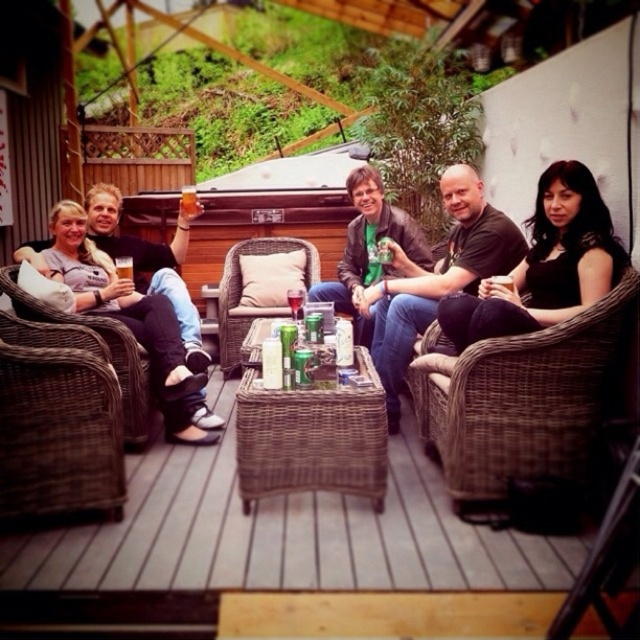
You are a guest at this outdoor gathering and want to sit in a chair that is taller. Which chair should you choose between the brown wicker chair at left and the woven wicker chair at center?

The woven wicker chair at center is taller than the brown wicker chair at left, so you should choose the woven wicker chair at center.

You are a person who is 1.8 meters tall and wants to sit on the brown wicker chair at lower left. However, you notice the matte plastic cup at center is placed on the seat. Can you sit down comfortably without bending over?

The brown wicker chair at lower left is much taller as matte plastic cup at center, so the chair is taller than the cup. Since the chair is taller, you can sit comfortably without bending over, but you should first move the matte plastic cup at center from the seat.